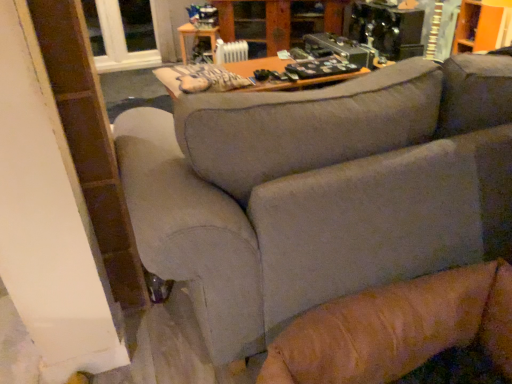
The height and width of the screenshot is (384, 512). What are the coordinates of `gray fabric couch at center` in the screenshot? It's located at (319, 190).

Where is `white plastic radiator at upper center`? white plastic radiator at upper center is located at coordinates (231, 52).

Is wooden table at center inside the boundaries of gray fabric couch at center, or outside?

wooden table at center is located beyond the bounds of gray fabric couch at center.

Considering the sizes of objects wooden table at center and gray fabric couch at center in the image provided, who is thinner, wooden table at center or gray fabric couch at center?

With smaller width is wooden table at center.

Considering the relative positions of wooden table at center and gray fabric couch at center in the image provided, is wooden table at center to the right of gray fabric couch at center from the viewer's perspective?

No, wooden table at center is not to the right of gray fabric couch at center.

I want to click on table on the left of gray fabric couch at center, so click(x=195, y=36).

Does wooden table at center have a greater height compared to clear glass window at upper left?

In fact, wooden table at center may be shorter than clear glass window at upper left.

Would you say wooden table at center is a long distance from clear glass window at upper left?

No, wooden table at center is not far away from clear glass window at upper left.

Based on the photo, does wooden table at center have a greater width compared to clear glass window at upper left?

Yes.

Is white plastic radiator at upper center wider than wooden cabinet at upper center?

No.

Is white plastic radiator at upper center turned away from wooden cabinet at upper center?

Yes.

In the scene shown: Is white plastic radiator at upper center taller than wooden cabinet at upper center?

No.

From the picture: Considering the sizes of gray fabric couch at center and clear glass window at upper left in the image, is gray fabric couch at center taller or shorter than clear glass window at upper left?

gray fabric couch at center is taller than clear glass window at upper left.

How much distance is there between gray fabric couch at center and clear glass window at upper left?

They are 3.83 meters apart.

Can you confirm if gray fabric couch at center is smaller than clear glass window at upper left?

No, gray fabric couch at center is not smaller than clear glass window at upper left.

Can you confirm if gray fabric couch at center is positioned to the right of clear glass window at upper left?

Indeed, gray fabric couch at center is positioned on the right side of clear glass window at upper left.

From the image's perspective, would you say white plastic radiator at upper center is shown under clear glass window at upper left?

Correct, white plastic radiator at upper center appears lower than clear glass window at upper left in the image.

Is clear glass window at upper left completely or partially inside white plastic radiator at upper center?

No.

Considering the positions of objects white plastic radiator at upper center and clear glass window at upper left in the image provided, who is more to the right, white plastic radiator at upper center or clear glass window at upper left?

Positioned to the right is white plastic radiator at upper center.

Which point is more distant from viewer, (245, 44) or (104, 31)?

The point (104, 31) is farther.

From a real-world perspective, who is located higher, gray fabric couch at center or wooden cabinet at upper center?

gray fabric couch at center.

Considering the relative sizes of gray fabric couch at center and wooden cabinet at upper center in the image provided, is gray fabric couch at center shorter than wooden cabinet at upper center?

No, gray fabric couch at center is not shorter than wooden cabinet at upper center.

From the image's perspective, is gray fabric couch at center under wooden cabinet at upper center?

Yes, from the image's perspective, gray fabric couch at center is below wooden cabinet at upper center.

What's the angular difference between gray fabric couch at center and wooden cabinet at upper center's facing directions?

145 degrees.

Measure the distance from white plastic radiator at upper center to gray fabric couch at center.

white plastic radiator at upper center and gray fabric couch at center are 1.80 meters apart.

From the image's perspective, relative to gray fabric couch at center, is white plastic radiator at upper center above or below?

Answer: Based on their image positions, white plastic radiator at upper center is located above gray fabric couch at center.

At what (x,y) coordinates should I click in order to perform the action: click on studio couch located in front of the white plastic radiator at upper center. Please return your answer as a coordinate pair (x, y). This screenshot has width=512, height=384. Looking at the image, I should click on (319, 190).

Between white plastic radiator at upper center and gray fabric couch at center, which one has larger width?

Wider between the two is gray fabric couch at center.

This screenshot has height=384, width=512. Find the location of `table above the gray fabric couch at center (from the image's perspective)`. table above the gray fabric couch at center (from the image's perspective) is located at coordinates [x=195, y=36].

This screenshot has width=512, height=384. I want to click on table that appears in front of the clear glass window at upper left, so click(x=195, y=36).

Estimate the real-world distances between objects in this image. Which object is further from wooden cabinet at upper center, white plastic radiator at upper center or wooden table at center?

Among the two, white plastic radiator at upper center is located further to wooden cabinet at upper center.

From the image, which object appears to be farther from wooden table at center, clear glass window at upper left or wooden cabinet at upper center?

wooden cabinet at upper center.

Based on their spatial positions, is clear glass window at upper left or wooden cabinet at upper center closer to gray fabric couch at center?

Based on the image, wooden cabinet at upper center appears to be nearer to gray fabric couch at center.

Looking at the image, which one is located closer to wooden table at center, white plastic radiator at upper center or clear glass window at upper left?

clear glass window at upper left.

Based on their spatial positions, is wooden table at center or gray fabric couch at center closer to clear glass window at upper left?

Among the two, wooden table at center is located nearer to clear glass window at upper left.

Estimate the real-world distances between objects in this image. Which object is further from gray fabric couch at center, wooden table at center or clear glass window at upper left?

Among the two, clear glass window at upper left is located further to gray fabric couch at center.

Looking at this image, which object lies nearer to the anchor point gray fabric couch at center, wooden cabinet at upper center or white plastic radiator at upper center?

Among the two, white plastic radiator at upper center is located nearer to gray fabric couch at center.

Estimate the real-world distances between objects in this image. Which object is further from white plastic radiator at upper center, wooden table at center or gray fabric couch at center?

Among the two, gray fabric couch at center is located further to white plastic radiator at upper center.

Where is `radiator between gray fabric couch at center and clear glass window at upper left from front to back`? Image resolution: width=512 pixels, height=384 pixels. radiator between gray fabric couch at center and clear glass window at upper left from front to back is located at coordinates (231, 52).

Image resolution: width=512 pixels, height=384 pixels. Identify the location of radiator between wooden table at center and wooden cabinet at upper center from left to right. tap(231, 52).

Locate an element on the screen. radiator between gray fabric couch at center and wooden table at center from front to back is located at coordinates (231, 52).

Identify the location of table between clear glass window at upper left and wooden cabinet at upper center from left to right. This screenshot has height=384, width=512. (195, 36).